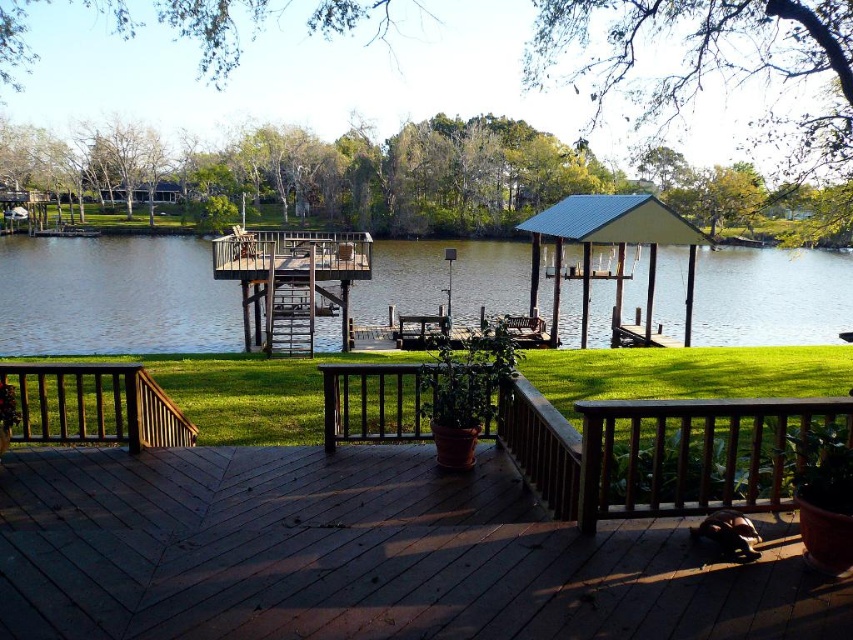
You are standing at the point with coordinates (345, 556) in the image. Based on the scene description, what object are you most likely standing on?

The point at coordinates (345, 556) corresponds to the wooden deck at center, so you are most likely standing on the wooden deck at center.

You are planning to take a photo of the clear water at center and the brown wooden gazebo at center from the wooden deck. Which object will appear bigger in the photo?

The clear water at center will appear bigger in the photo because it has a larger size compared to the brown wooden gazebo at center.